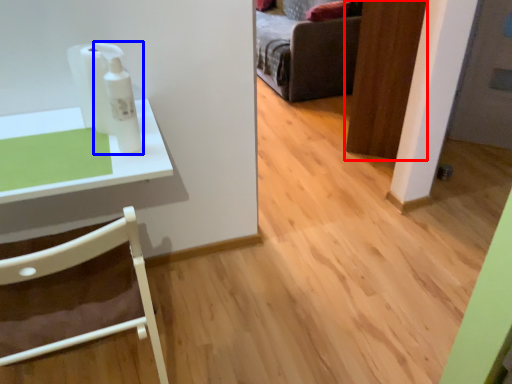
Question: Among these objects, which one is nearest to the camera, door (highlighted by a red box) or toiletry (highlighted by a blue box)?

Choices:
 (A) door
 (B) toiletry

Answer: (B)